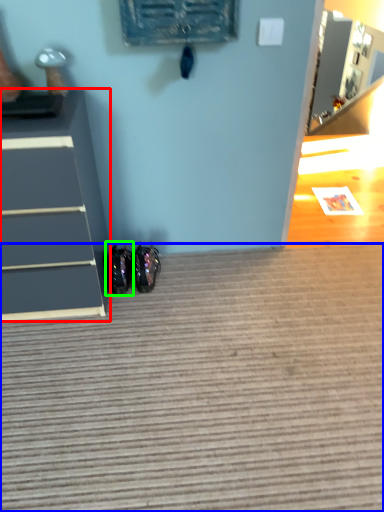
Question: Which object is the farthest from chest of drawers (highlighted by a red box)? Choose among these: doormat (highlighted by a blue box) or footwear (highlighted by a green box).

Choices:
 (A) doormat
 (B) footwear

Answer: (A)